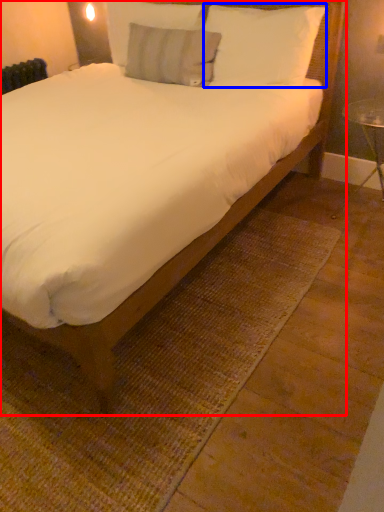
Question: Which of the following is the farthest to the observer, bed (highlighted by a red box) or pillow (highlighted by a blue box)?

Choices:
 (A) bed
 (B) pillow

Answer: (B)